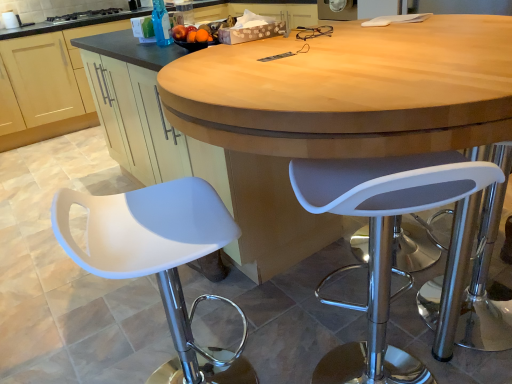
Locate an element on the screen. This screenshot has width=512, height=384. free spot below matte wood table at center (from a real-world perspective) is located at coordinates (344, 299).